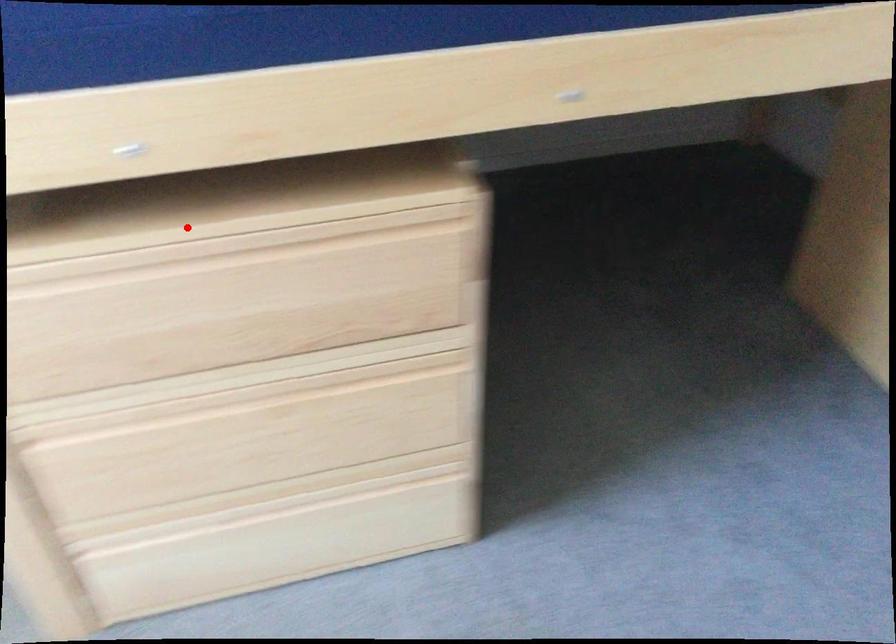
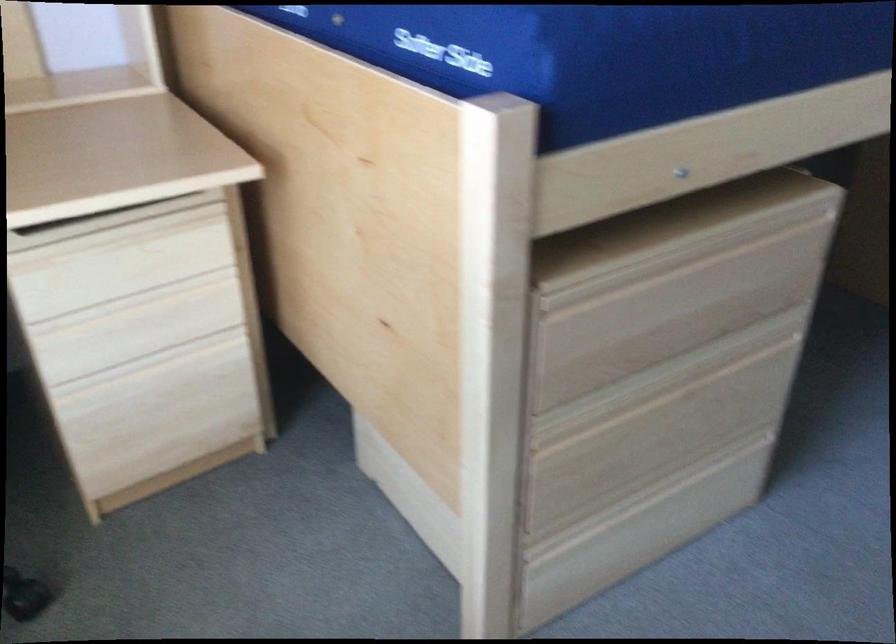
Where in the second image is the point corresponding to the highlighted location from the first image?

(668, 240)